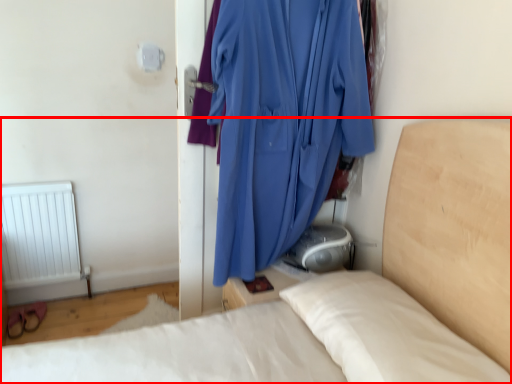
Question: From the image's perspective, what is the correct spatial relationship of bed (annotated by the red box) in relation to curtain?

Choices:
 (A) above
 (B) below

Answer: (B)